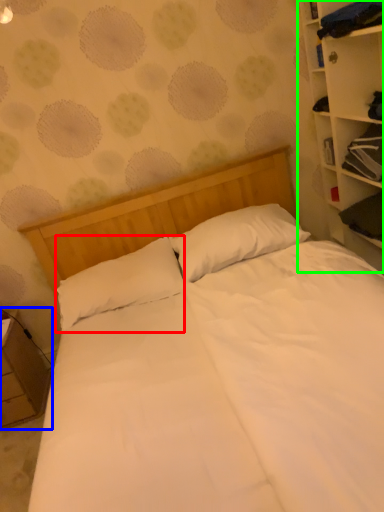
Question: Which is nearer to the pillow (highlighted by a red box)? nightstand (highlighted by a blue box) or bookcase (highlighted by a green box).

Choices:
 (A) nightstand
 (B) bookcase

Answer: (A)